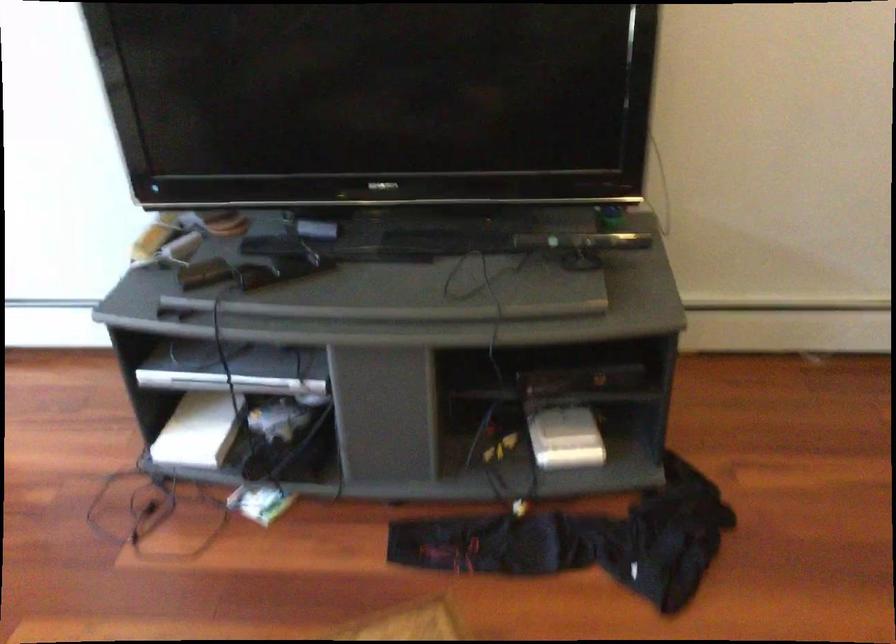
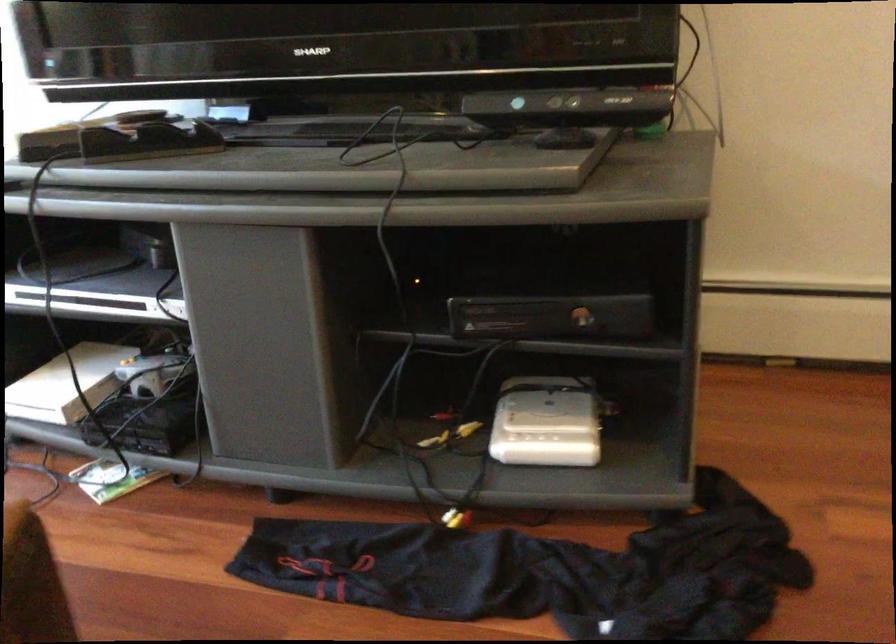
In a continuous first-person perspective shot, in which direction is the camera moving?

The cameraman walked toward right, forward.